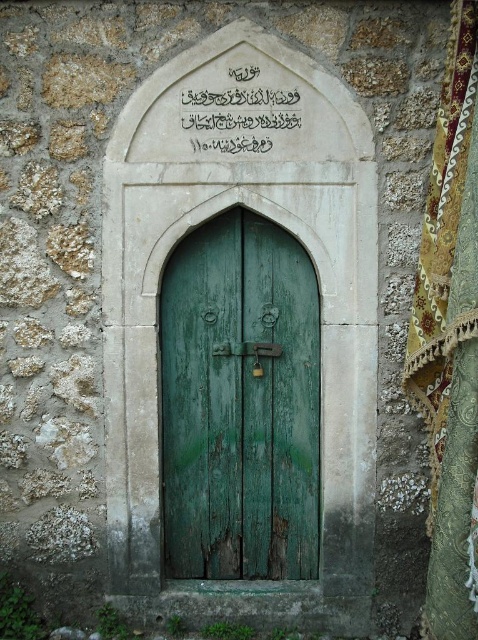
Is green wooden door at center positioned before black stone writing at center?

No.

Is point (186, 486) more distant than point (260, 152)?

Yes, it is behind point (260, 152).

Locate an element on the screen. The width and height of the screenshot is (478, 640). green wooden door at center is located at coordinates (239, 403).